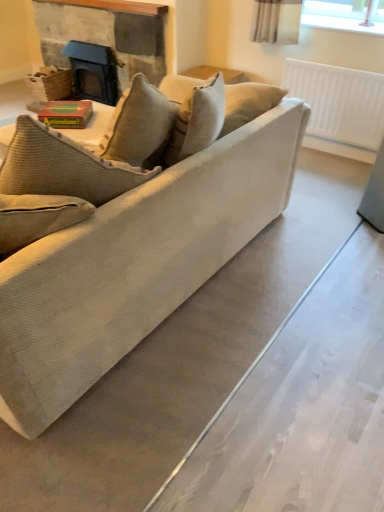
Question: Is matte black fireplace at upper left taller or shorter than beige corduroy couch at center?

Choices:
 (A) short
 (B) tall

Answer: (A)

Question: Looking at their shapes, would you say matte black fireplace at upper left is wider or thinner than beige corduroy couch at center?

Choices:
 (A) wide
 (B) thin

Answer: (B)

Question: Which is nearer to the matte black fireplace at upper left?

Choices:
 (A) yellow-green cardboard book at center
 (B) white plastic radiator at upper right
 (C) beige corduroy couch at center

Answer: (A)

Question: Estimate the real-world distances between objects in this image. Which object is farther from the beige corduroy couch at center?

Choices:
 (A) matte black fireplace at upper left
 (B) yellow-green cardboard book at center
 (C) white plastic radiator at upper right

Answer: (A)